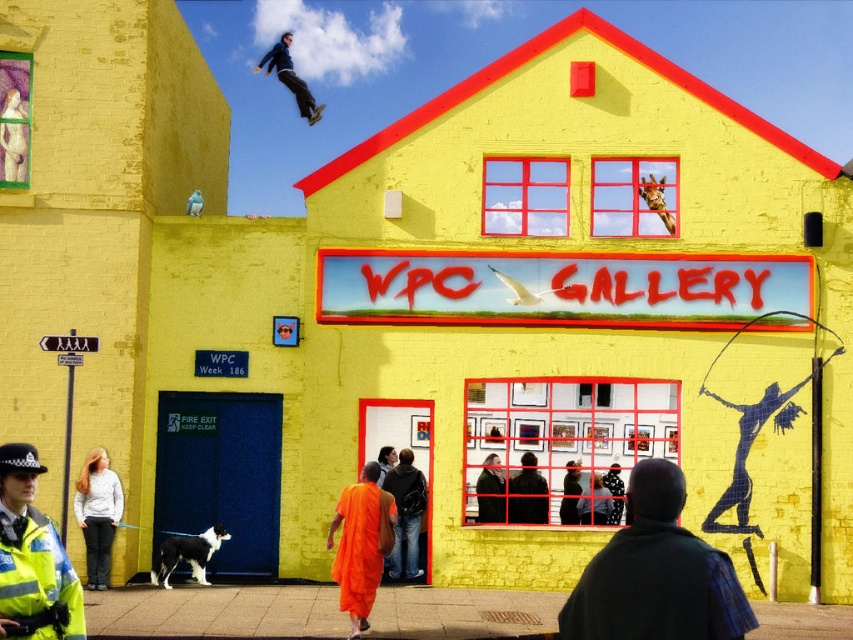
Does reflective blue uniform at lower left have a greater width compared to light gray sweater at lower left?

Yes.

Find the location of a particular element. This screenshot has height=640, width=853. reflective blue uniform at lower left is located at coordinates (32, 557).

Who is higher up, reflective blue uniform at lower left or blue smooth skateboard at upper center?

blue smooth skateboard at upper center is higher up.

This screenshot has width=853, height=640. I want to click on reflective blue uniform at lower left, so click(x=32, y=557).

Between point (36, 602) and point (277, 64), which one is positioned in front?

Point (36, 602) is in front.

Find the location of `reflective blue uniform at lower left`. reflective blue uniform at lower left is located at coordinates (32, 557).

Can you confirm if dark blue fabric at lower right is taller than blue smooth skateboard at upper center?

No, dark blue fabric at lower right is not taller than blue smooth skateboard at upper center.

Does point (700, 634) lie in front of point (271, 58)?

That is True.

Find the location of `dark blue fabric at lower right`. dark blue fabric at lower right is located at coordinates (656, 573).